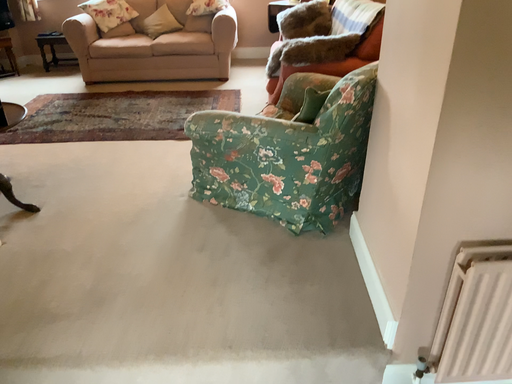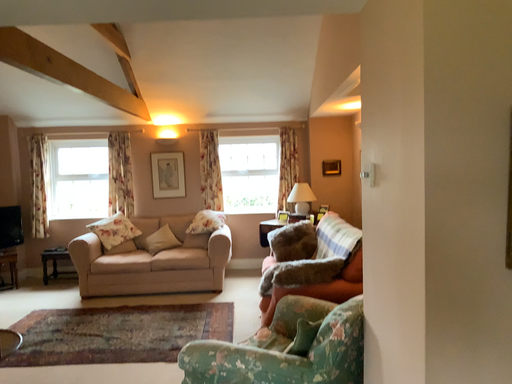
Question: How did the camera likely rotate when shooting the video?

Choices:
 (A) rotated upward
 (B) rotated downward

Answer: (A)